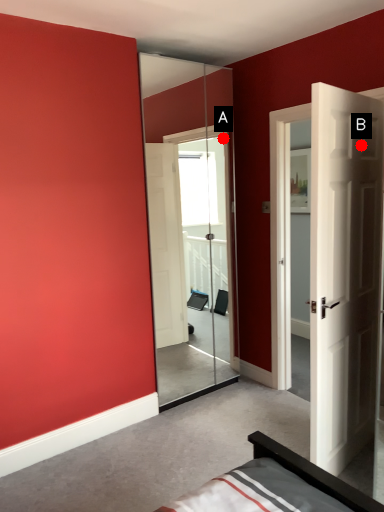
Question: Two points are circled on the image, labeled by A and B beside each circle. Which point is closer to the camera?

Choices:
 (A) A is closer
 (B) B is closer

Answer: (B)